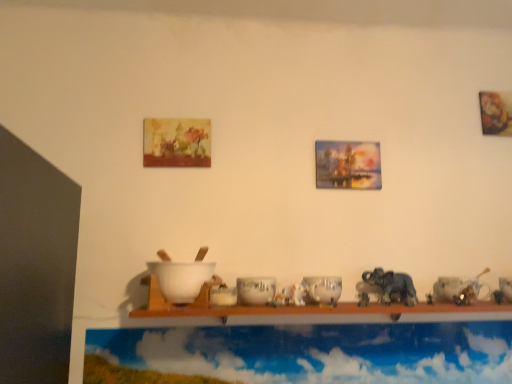
Question: Is white glossy bowl at center, which ranks as the 1th tableware in left-to-right order, inside or outside of oil painting ship at center, positioned as the second picture frame in left-to-right order?

Choices:
 (A) outside
 (B) inside

Answer: (A)

Question: Is point click(214, 291) closer or farther from the camera than point click(338, 178)?

Choices:
 (A) farther
 (B) closer

Answer: (B)

Question: Estimate the real-world distances between objects in this image. Which object is farther from the white glossy bowl at center, the fourth tableware from the left?

Choices:
 (A) metallic gray elephant at lower right
 (B) white matte mixing bowl at center
 (C) matte ceramic vase at center, positioned as the second tableware in right-to-left order
 (D) oil painting ship at center, which is the first picture frame from right to left
 (E) white glossy bowl at center, which ranks as the 1th tableware in left-to-right order

Answer: (B)

Question: Which of these objects is positioned closest to the white glossy bowl at center, the fourth tableware positioned from the right?

Choices:
 (A) matte wooden picture frame at upper center, marked as the 2th picture frame in a right-to-left arrangement
 (B) white matte mixing bowl at center
 (C) white glossy bowl at center, the fourth tableware from the left
 (D) cloudy sky at upper center
 (E) metallic gray elephant at lower right

Answer: (B)